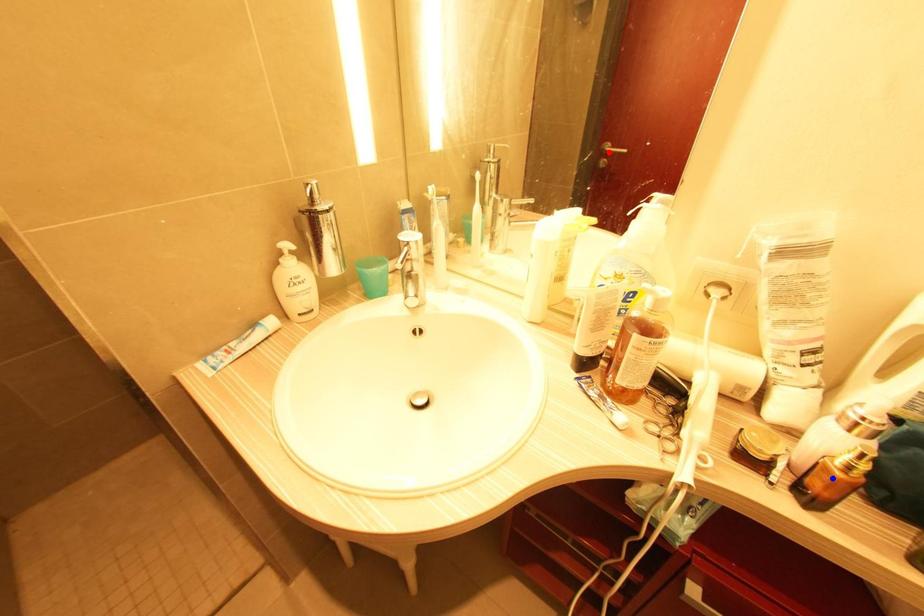
Question: Which of the two points in the image is closer to the camera?

Choices:
 (A) Blue point is closer.
 (B) Red point is closer.

Answer: (A)